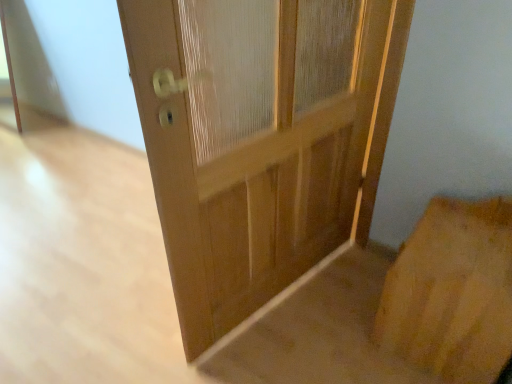
The image size is (512, 384). I want to click on free spot to the left of brown cardboard at lower right, so click(342, 329).